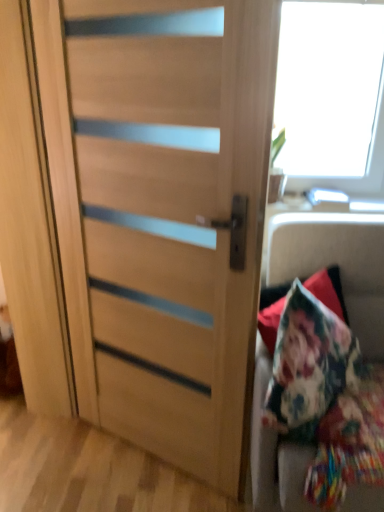
Question: Is wooden door at center far from floral fabric cushion at right?

Choices:
 (A) no
 (B) yes

Answer: (A)

Question: Does wooden door at center have a greater width compared to floral fabric cushion at right?

Choices:
 (A) yes
 (B) no

Answer: (B)

Question: Considering the relative positions of wooden door at center and floral fabric cushion at right in the image provided, is wooden door at center to the right of floral fabric cushion at right from the viewer's perspective?

Choices:
 (A) no
 (B) yes

Answer: (A)

Question: Is wooden door at center smaller than floral fabric cushion at right?

Choices:
 (A) no
 (B) yes

Answer: (B)

Question: Can you confirm if wooden door at center is thinner than floral fabric cushion at right?

Choices:
 (A) yes
 (B) no

Answer: (A)

Question: From the image's perspective, is wooden door at center located above floral fabric cushion at right?

Choices:
 (A) yes
 (B) no

Answer: (A)

Question: Does floral fabric cushion at right have a greater width compared to wooden door at center?

Choices:
 (A) no
 (B) yes

Answer: (B)

Question: Does floral fabric cushion at right have a larger size compared to wooden door at center?

Choices:
 (A) yes
 (B) no

Answer: (A)

Question: Are floral fabric cushion at right and wooden door at center located far from each other?

Choices:
 (A) yes
 (B) no

Answer: (B)

Question: Considering the relative positions of floral fabric cushion at right and wooden door at center in the image provided, is floral fabric cushion at right to the left of wooden door at center from the viewer's perspective?

Choices:
 (A) yes
 (B) no

Answer: (B)

Question: Is floral fabric cushion at right facing towards wooden door at center?

Choices:
 (A) no
 (B) yes

Answer: (A)

Question: Is floral fabric cushion at right with wooden door at center?

Choices:
 (A) no
 (B) yes

Answer: (A)

Question: In terms of height, does wooden door at center look taller or shorter compared to floral fabric cushion at right?

Choices:
 (A) short
 (B) tall

Answer: (B)